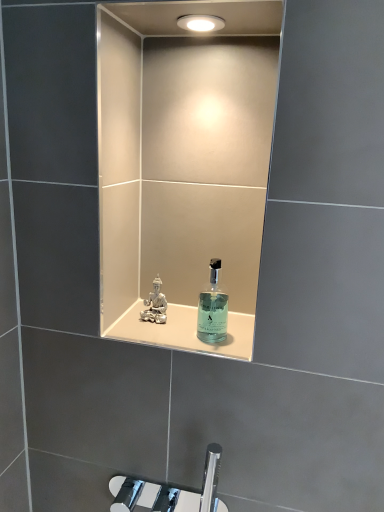
The image size is (384, 512). What are the coordinates of `clear glass perfume at center` in the screenshot? It's located at (155, 304).

At what (x,y) coordinates should I click in order to perform the action: click on transparent glass bottle at center. Please return your answer as a coordinate pair (x, y). Image resolution: width=384 pixels, height=512 pixels. Looking at the image, I should click on (213, 308).

Find the location of `translucent glass bottle at center`. translucent glass bottle at center is located at coordinates 184,331.

Is transparent glass bottle at center further to the viewer compared to translucent glass bottle at center?

No, transparent glass bottle at center is closer to the viewer.

Is translucent glass bottle at center inside transparent glass bottle at center?

That's incorrect, translucent glass bottle at center is not inside transparent glass bottle at center.

In terms of height, does transparent glass bottle at center look taller or shorter compared to translucent glass bottle at center?

Clearly, transparent glass bottle at center is taller compared to translucent glass bottle at center.

From the image's perspective, is clear glass perfume at center located above or below translucent glass bottle at center?

clear glass perfume at center is situated higher than translucent glass bottle at center in the image.

Is clear glass perfume at center with translucent glass bottle at center?

Yes, clear glass perfume at center is touching translucent glass bottle at center.

From the picture: Which is more to the left, clear glass perfume at center or translucent glass bottle at center?

clear glass perfume at center is more to the left.

Considering the relative sizes of clear glass perfume at center and translucent glass bottle at center in the image provided, is clear glass perfume at center taller than translucent glass bottle at center?

Yes.

From a real-world perspective, who is located higher, translucent glass bottle at center or clear glass perfume at center?

clear glass perfume at center.

Consider the image. Is translucent glass bottle at center oriented towards clear glass perfume at center?

No, translucent glass bottle at center is not aimed at clear glass perfume at center.

Does translucent glass bottle at center have a smaller size compared to clear glass perfume at center?

No, translucent glass bottle at center is not smaller than clear glass perfume at center.

Who is taller, translucent glass bottle at center or clear glass perfume at center?

clear glass perfume at center is taller.

From a real-world perspective, is clear glass perfume at center positioned over transparent glass bottle at center based on gravity?

No, from a real-world perspective, clear glass perfume at center is not on top of transparent glass bottle at center.

Who is taller, clear glass perfume at center or transparent glass bottle at center?

transparent glass bottle at center is taller.

Is clear glass perfume at center positioned with its back to transparent glass bottle at center?

No, transparent glass bottle at center is not at the back of clear glass perfume at center.

Who is bigger, clear glass perfume at center or transparent glass bottle at center?

transparent glass bottle at center is bigger.

From the image's perspective, is transparent glass bottle at center on top of clear glass perfume at center?

No.

Does transparent glass bottle at center have a lesser height compared to clear glass perfume at center?

In fact, transparent glass bottle at center may be taller than clear glass perfume at center.

Considering the sizes of translucent glass bottle at center and transparent glass bottle at center in the image, is translucent glass bottle at center wider or thinner than transparent glass bottle at center?

In the image, translucent glass bottle at center appears to be wider than transparent glass bottle at center.

Does translucent glass bottle at center appear on the right side of transparent glass bottle at center?

In fact, translucent glass bottle at center is to the left of transparent glass bottle at center.

Is translucent glass bottle at center spatially inside transparent glass bottle at center, or outside of it?

translucent glass bottle at center is not inside transparent glass bottle at center, it's outside.

This screenshot has width=384, height=512. There is a translucent glass bottle at center. Find the location of `bottle above it (from a real-world perspective)`. bottle above it (from a real-world perspective) is located at coordinates (213, 308).

At what (x,y) coordinates should I click in order to perform the action: click on perfume behind the translucent glass bottle at center. Please return your answer as a coordinate pair (x, y). Looking at the image, I should click on (155, 304).

When comparing their distances from clear glass perfume at center, does translucent glass bottle at center or transparent glass bottle at center seem closer?

The object closer to clear glass perfume at center is translucent glass bottle at center.

Looking at the image, which one is located closer to translucent glass bottle at center, clear glass perfume at center or transparent glass bottle at center?

Among the two, transparent glass bottle at center is located nearer to translucent glass bottle at center.

Estimate the real-world distances between objects in this image. Which object is closer to transparent glass bottle at center, translucent glass bottle at center or clear glass perfume at center?

Based on the image, translucent glass bottle at center appears to be nearer to transparent glass bottle at center.

Which object lies further to the anchor point transparent glass bottle at center, clear glass perfume at center or translucent glass bottle at center?

clear glass perfume at center.

From the image, which object appears to be farther from translucent glass bottle at center, transparent glass bottle at center or clear glass perfume at center?

clear glass perfume at center.

Considering their positions, is transparent glass bottle at center positioned closer to clear glass perfume at center than translucent glass bottle at center?

Based on the image, translucent glass bottle at center appears to be nearer to clear glass perfume at center.

Find the location of a particular element. shelve between transparent glass bottle at center and clear glass perfume at center along the z-axis is located at coordinates (184, 331).